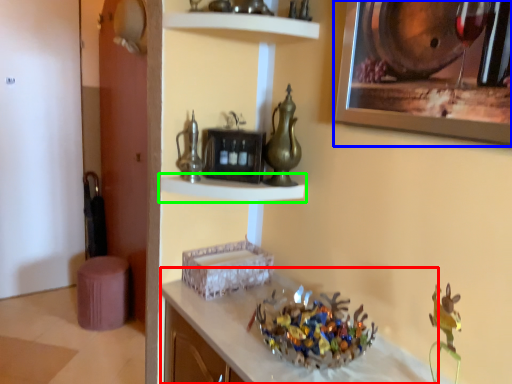
Question: Which object is the farthest from counter (highlighted by a red box)? Choose among these: picture frame (highlighted by a blue box) or shelf (highlighted by a green box).

Choices:
 (A) picture frame
 (B) shelf

Answer: (A)